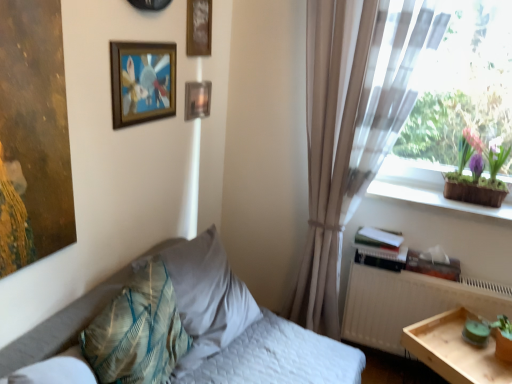
Question: From the image's perspective, is light wood tray at lower right under white quilted bed at lower left?

Choices:
 (A) no
 (B) yes

Answer: (B)

Question: Is light wood tray at lower right thinner than white quilted bed at lower left?

Choices:
 (A) yes
 (B) no

Answer: (A)

Question: Is light wood tray at lower right at the right side of white quilted bed at lower left?

Choices:
 (A) yes
 (B) no

Answer: (A)

Question: Would you say light wood tray at lower right is outside white quilted bed at lower left?

Choices:
 (A) yes
 (B) no

Answer: (A)

Question: Would you say white quilted bed at lower left is part of light wood tray at lower right's contents?

Choices:
 (A) yes
 (B) no

Answer: (B)

Question: Considering their positions, is textured beige pillow at center-left, the 1th pillow when ordered from back to front, located in front of or behind metallic rectangular frame at upper center, the first picture frame viewed from the back?

Choices:
 (A) behind
 (B) front

Answer: (B)

Question: From their relative heights in the image, would you say textured beige pillow at center-left, arranged as the second pillow when viewed from the front, is taller or shorter than metallic rectangular frame at upper center, the first picture frame viewed from the back?

Choices:
 (A) tall
 (B) short

Answer: (A)

Question: Which is correct: textured beige pillow at center-left, arranged as the second pillow when viewed from the front, is inside metallic rectangular frame at upper center, placed as the third picture frame when sorted from front to back, or outside of it?

Choices:
 (A) inside
 (B) outside

Answer: (B)

Question: From the image's perspective, is textured beige pillow at center-left, arranged as the second pillow when viewed from the front, above or below metallic rectangular frame at upper center, placed as the third picture frame when sorted from front to back?

Choices:
 (A) above
 (B) below

Answer: (B)

Question: Is point (194, 54) closer or farther from the camera than point (197, 362)?

Choices:
 (A) closer
 (B) farther

Answer: (B)

Question: From the image's perspective, is wooden picture frame at upper center, arranged as the second picture frame when viewed from the front, positioned above or below textured beige pillow at center-left, the 1th pillow when ordered from back to front?

Choices:
 (A) above
 (B) below

Answer: (A)

Question: From a real-world perspective, relative to textured beige pillow at center-left, the 1th pillow when ordered from back to front, is wooden picture frame at upper center, arranged as the second picture frame when viewed from the front, vertically above or below?

Choices:
 (A) below
 (B) above

Answer: (B)

Question: Is wooden picture frame at upper center, which appears as the 2th picture frame when viewed from the back, bigger or smaller than textured beige pillow at center-left, the 1th pillow when ordered from back to front?

Choices:
 (A) small
 (B) big

Answer: (A)

Question: From a real-world perspective, is textured beige pillow at center-left, arranged as the second pillow when viewed from the front, physically located above or below white matte radiator at right?

Choices:
 (A) above
 (B) below

Answer: (A)

Question: From the image's perspective, relative to white matte radiator at right, is textured beige pillow at center-left, arranged as the second pillow when viewed from the front, above or below?

Choices:
 (A) below
 (B) above

Answer: (B)